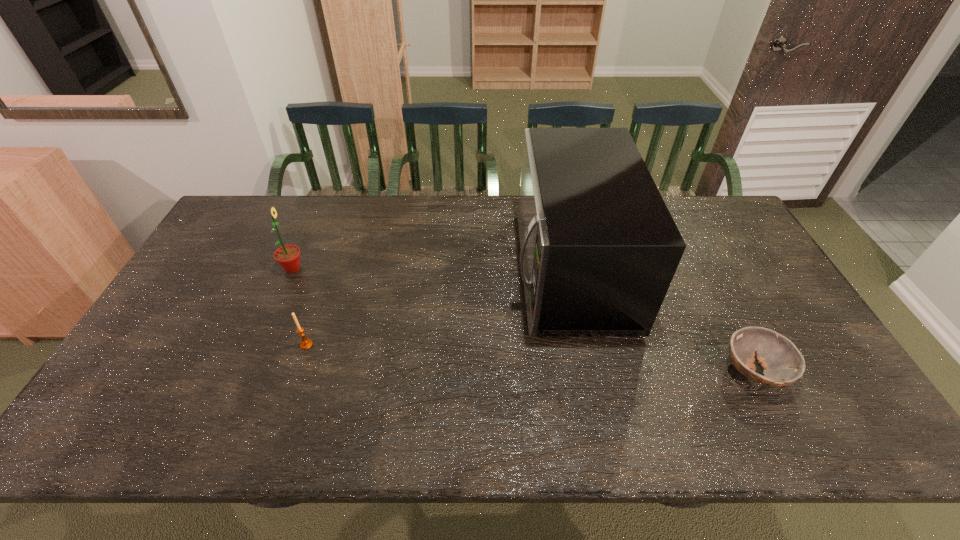
What are the coordinates of `object identified as the third closest to the microwave oven` in the screenshot? It's located at (288, 256).

Locate which object ranks second in proximity to the third tallest object. Please provide its 2D coordinates. Your answer should be formatted as a tuple, i.e. [(x, y)], where the tuple contains the x and y coordinates of a point satisfying the conditions above.

[(599, 248)]

Identify the location of free spot that satisfies the following two spatial constraints: 1. on the face of the leftmost object; 2. on the back side of the third tallest object. (260, 345).

Locate an element on the screen. free location that satisfies the following two spatial constraints: 1. on the face of the third object from right to left; 2. on the left side of the sunflower is located at coordinates (260, 345).

You are a GUI agent. You are given a task and a screenshot of the screen. Output one action in this format:
    pyautogui.click(x=<x>, y=<y>)
    Task: Click on the free space that satisfies the following two spatial constraints: 1. on the face of the leftmost object; 2. on the right side of the second shortest object
    
    Given the screenshot: What is the action you would take?
    pyautogui.click(x=260, y=345)

I want to click on free space in the image that satisfies the following two spatial constraints: 1. on the face of the shortest object; 2. on the left side of the sunflower, so click(x=249, y=372).

The image size is (960, 540). What are the coordinates of `free space that satisfies the following two spatial constraints: 1. on the face of the second tallest object; 2. on the back side of the bowl` in the screenshot? It's located at (249, 372).

You are a GUI agent. You are given a task and a screenshot of the screen. Output one action in this format:
    pyautogui.click(x=<x>, y=<y>)
    Task: Click on the free space that satisfies the following two spatial constraints: 1. with the door open on the tallest object; 2. on the front side of the third tallest object
    
    Given the screenshot: What is the action you would take?
    pyautogui.click(x=584, y=345)

The image size is (960, 540). Find the location of `free point that satisfies the following two spatial constraints: 1. on the front side of the third tallest object; 2. on the right side of the shortest object`. free point that satisfies the following two spatial constraints: 1. on the front side of the third tallest object; 2. on the right side of the shortest object is located at coordinates (298, 372).

Where is `vacant area in the image that satisfies the following two spatial constraints: 1. on the face of the second object from left to right; 2. on the left side of the leftmost object`? vacant area in the image that satisfies the following two spatial constraints: 1. on the face of the second object from left to right; 2. on the left side of the leftmost object is located at coordinates (260, 345).